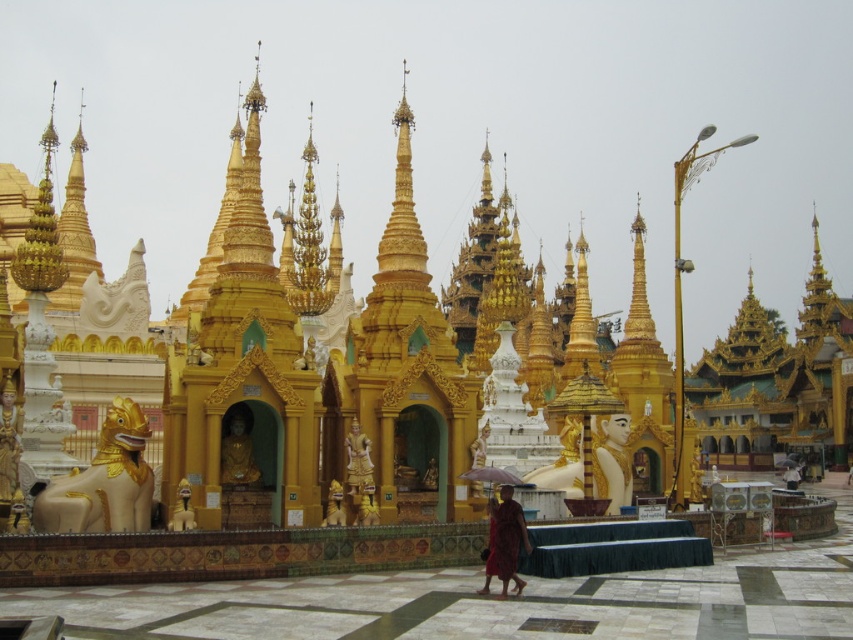
You are a tourist standing in front of the temple complex. You notice a red monk at center and a smooth beige statue at center. Which object appears narrower when viewed from your perspective?

The red monk at center appears narrower because it has a lesser width compared to the smooth beige statue at center.

You are a tourist visiting the temple complex and want to take a photo that includes both the golden polished statue at lower left and the gold polished statue at center. Which statue should you stand closer to in order to fit both into the frame?

You should stand closer to the golden polished statue at lower left because it is smaller than the gold polished statue at center, allowing you to capture both in the frame by adjusting your position accordingly.

You are an architect visiting the temple complex and want to compare the statues. Which statue at the center is thinner, the gold polished statue at center or the smooth beige statue at center?

The gold polished statue at center is thinner than the smooth beige statue at center.